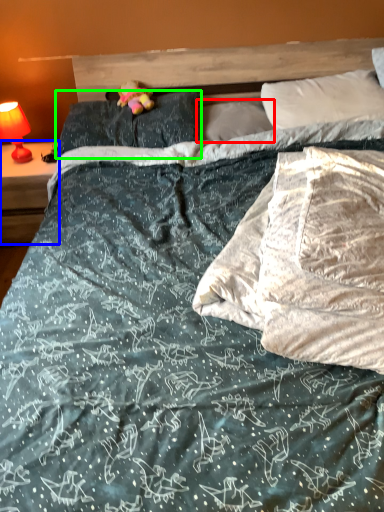
Question: Estimate the real-world distances between objects in this image. Which object is farther from pillow (highlighted by a red box), nightstand (highlighted by a blue box) or pillow (highlighted by a green box)?

Choices:
 (A) nightstand
 (B) pillow

Answer: (A)